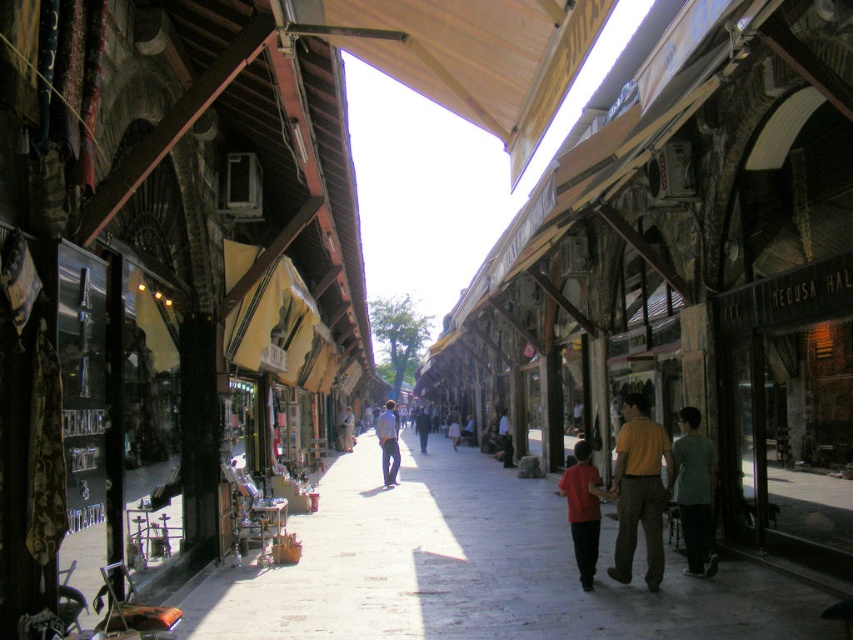
Question: Which object is positioned farthest from the matte red shirt at center?

Choices:
 (A) dark gray fabric jacket at center
 (B) light blue denim jeans at center
 (C) smooth concrete pavement at center

Answer: (A)

Question: Which of the following is the closest to the observer?

Choices:
 (A) smooth concrete pavement at center
 (B) light blue denim jeans at center

Answer: (A)

Question: Is dark blue jeans at center positioned before dark gray fabric jacket at center?

Choices:
 (A) yes
 (B) no

Answer: (A)

Question: Which point is closer to the camera?

Choices:
 (A) light brown leather jacket at center
 (B) dark blue jeans at center
 (C) gray cotton shirt at center

Answer: (C)

Question: Can you confirm if orange cotton shirt at center is positioned below light blue denim jeans at center?

Choices:
 (A) no
 (B) yes

Answer: (A)

Question: Can you confirm if orange cotton shirt at center is positioned below dark blue jeans at center?

Choices:
 (A) yes
 (B) no

Answer: (B)